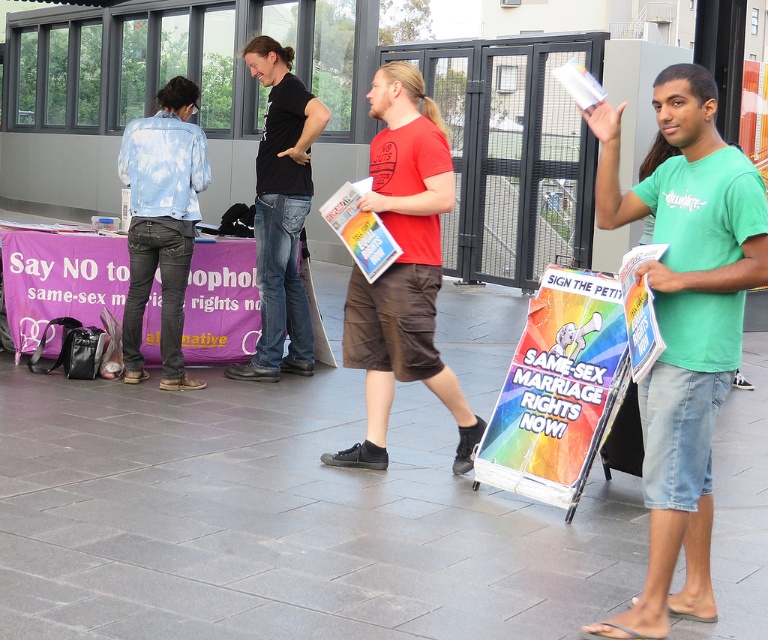
Question: From the image, what is the correct spatial relationship of green cotton t-shirt at center in relation to rainbow paper flyer at center?

Choices:
 (A) left
 (B) right

Answer: (B)

Question: Which point is closer to the camera?

Choices:
 (A) (717, 132)
 (B) (650, 326)
 (C) (359, 253)

Answer: (B)

Question: Does red matte t-shirt at center have a greater width compared to rainbow paper sign at center?

Choices:
 (A) no
 (B) yes

Answer: (B)

Question: Considering the real-world distances, which object is closest to the black cotton shirt at center?

Choices:
 (A) tie-dye denim jacket at left
 (B) rainbow paper flyer at center
 (C) rainbow paper sign at center
 (D) green cotton t-shirt at center

Answer: (A)

Question: Does green cotton t-shirt at center have a smaller size compared to matte paper poster at right?

Choices:
 (A) yes
 (B) no

Answer: (B)

Question: Which point appears closest to the camera in this image?

Choices:
 (A) (636, 259)
 (B) (614, 179)
 (C) (576, 310)
 (D) (209, 272)

Answer: (A)